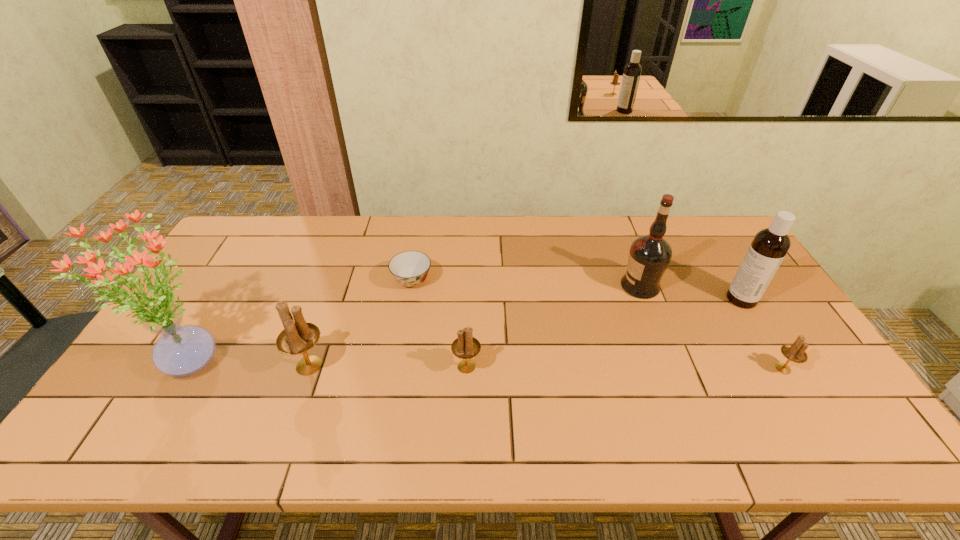
Where is `free space between the second tallest candle holder and the shortest object`? This screenshot has width=960, height=540. free space between the second tallest candle holder and the shortest object is located at coordinates (440, 323).

The width and height of the screenshot is (960, 540). I want to click on vacant space in between the shortest candle holder and the tallest candle holder, so click(546, 367).

Identify the location of free space between the sixth object from right to left and the leftmost object. (249, 363).

The width and height of the screenshot is (960, 540). I want to click on empty location between the dishwasher detergent and the shortest object, so click(x=577, y=290).

Where is `object that is the closest to the flower arrangement`? object that is the closest to the flower arrangement is located at coordinates (297, 338).

You are a GUI agent. You are given a task and a screenshot of the screen. Output one action in this format:
    pyautogui.click(x=<x>, y=<y>)
    Task: Click on the second closest object to the soup bowl
    
    Given the screenshot: What is the action you would take?
    pyautogui.click(x=465, y=347)

I want to click on candle holder identified as the second closest to the second object from left to right, so click(795, 352).

Find the location of a particular element. This screenshot has height=540, width=960. candle holder identified as the closest to the fifth tallest object is located at coordinates (297, 338).

The width and height of the screenshot is (960, 540). I want to click on vacant point that satisfies the following two spatial constraints: 1. on the front side of the sixth object from right to left; 2. on the right side of the second candle holder from right to left, so click(309, 367).

In order to click on free spot that satisfies the following two spatial constraints: 1. on the surface of the liquor; 2. on the left side of the second shortest object in this screenshot , I will do `click(672, 369)`.